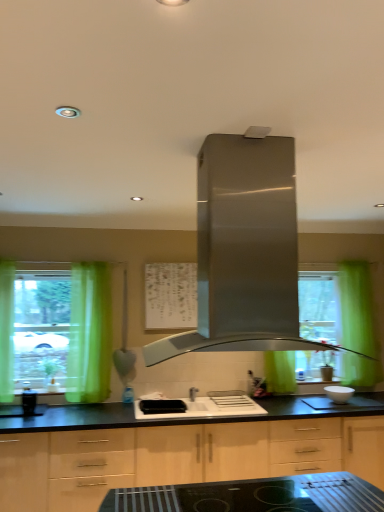
This screenshot has width=384, height=512. Find the location of `free space above white glossy sink at center (from a real-world perspective)`. free space above white glossy sink at center (from a real-world perspective) is located at coordinates (213, 402).